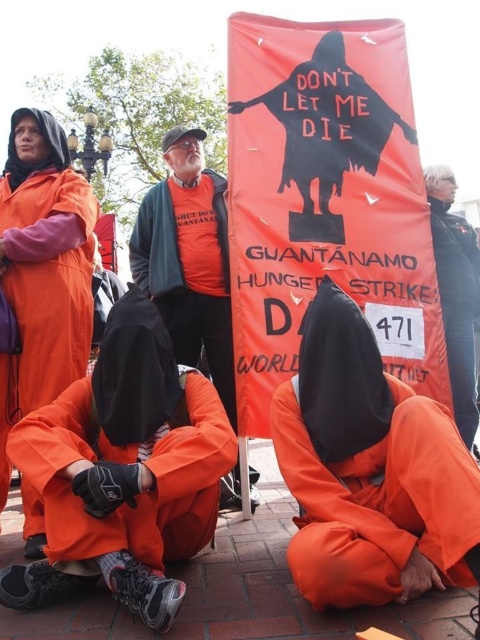
Between point (220, 337) and point (467, 360), which one is positioned in front?

Point (467, 360) is more forward.

Does point (177, 285) lie in front of point (453, 214)?

Yes, point (177, 285) is in front of point (453, 214).

Where is `orange cotton shirt at center`? This screenshot has height=640, width=480. orange cotton shirt at center is located at coordinates (189, 259).

Where is `orange cotton shirt at center`? The image size is (480, 640). orange cotton shirt at center is located at coordinates (189, 259).